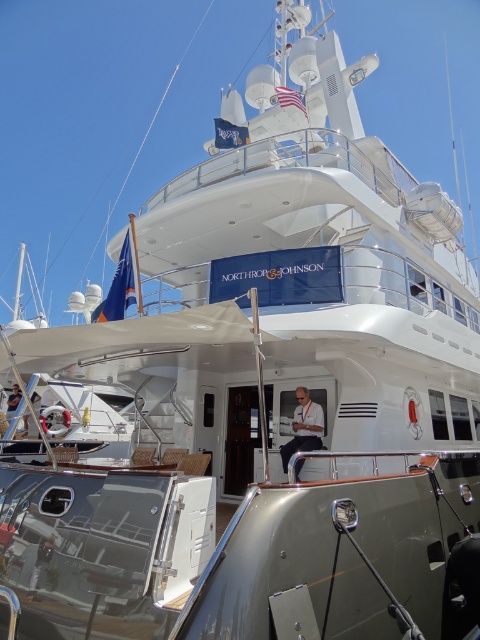
You are a photographer on the yacht and want to capture a photo of the white fabric shirt at center and the matte black laptop at upper center. Which object appears narrower in the photo?

The white fabric shirt at center appears narrower in the photo because it is thinner than the matte black laptop at upper center.

In the scene shown: What is the position of the white fabric shirt at center on the yacht deck?

The white fabric shirt at center is located at point 0.669 on the x axis and 0.633 on the y axis.

You are standing on the deck of the yacht and want to take a photo of both point (321, 410) and point (10, 410). Which point will appear larger in your photo?

Point (321, 410) will appear larger in the photo because it is closer to the camera than point (10, 410).